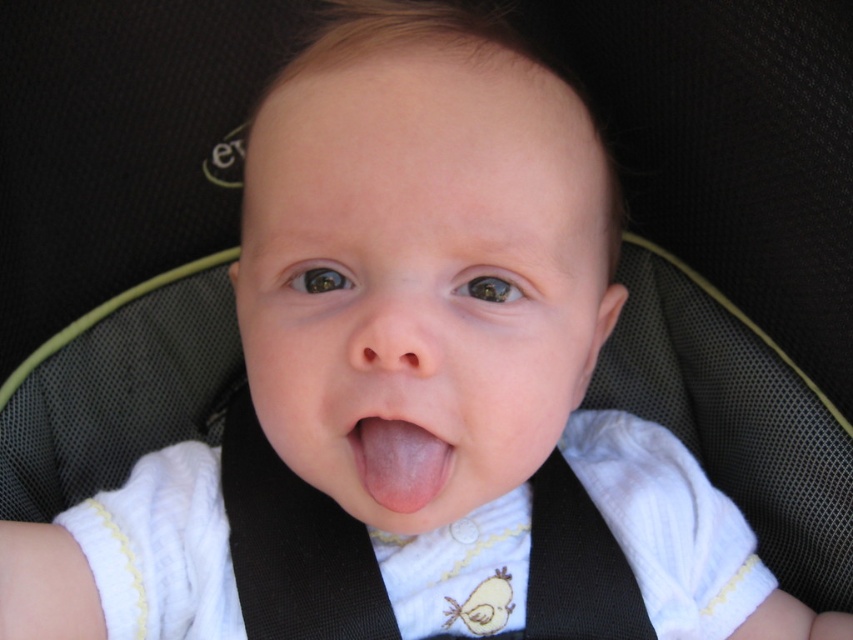
Measure the distance from white ribbed fabric bib at center to pink smooth tongue at center.

white ribbed fabric bib at center is 8.34 inches away from pink smooth tongue at center.

Is white ribbed fabric bib at center shorter than pink smooth tongue at center?

Incorrect, white ribbed fabric bib at center's height does not fall short of pink smooth tongue at center's.

Is point (160, 474) behind point (440, 474)?

Yes, it is.

Find the location of a particular element. white ribbed fabric bib at center is located at coordinates tap(666, 524).